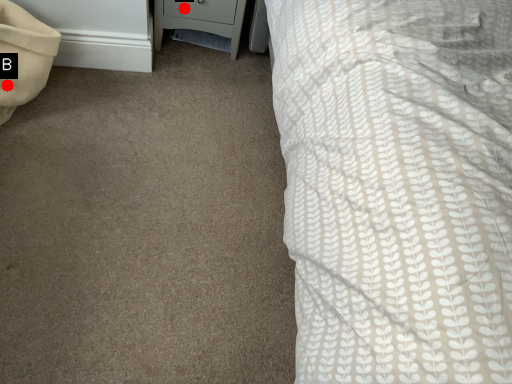
Question: Two points are circled on the image, labeled by A and B beside each circle. Which point is further to the camera?

Choices:
 (A) A is further
 (B) B is further

Answer: (A)